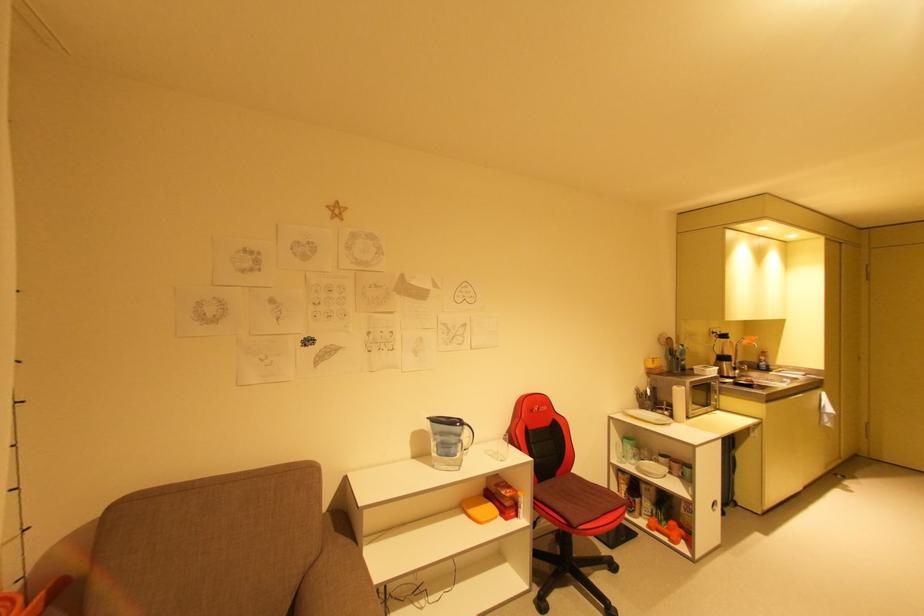
Identify the location of silver door handle. (714, 506).